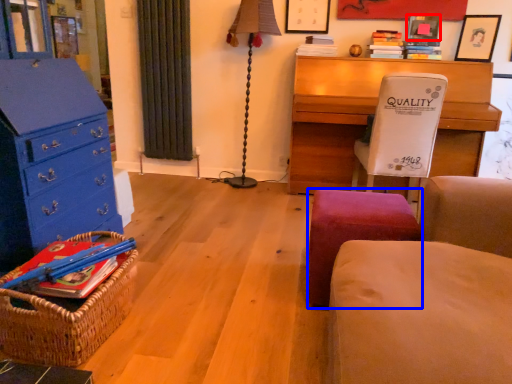
Question: Which point is closer to the camera, picture frame (highlighted by a red box) or stool (highlighted by a blue box)?

Choices:
 (A) picture frame
 (B) stool

Answer: (B)